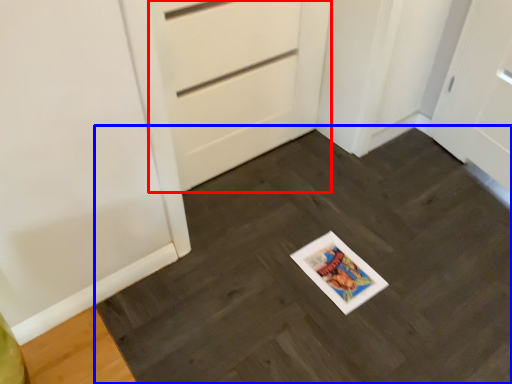
Question: Which point is closer to the camera, door (highlighted by a red box) or slate (highlighted by a blue box)?

Choices:
 (A) door
 (B) slate

Answer: (B)